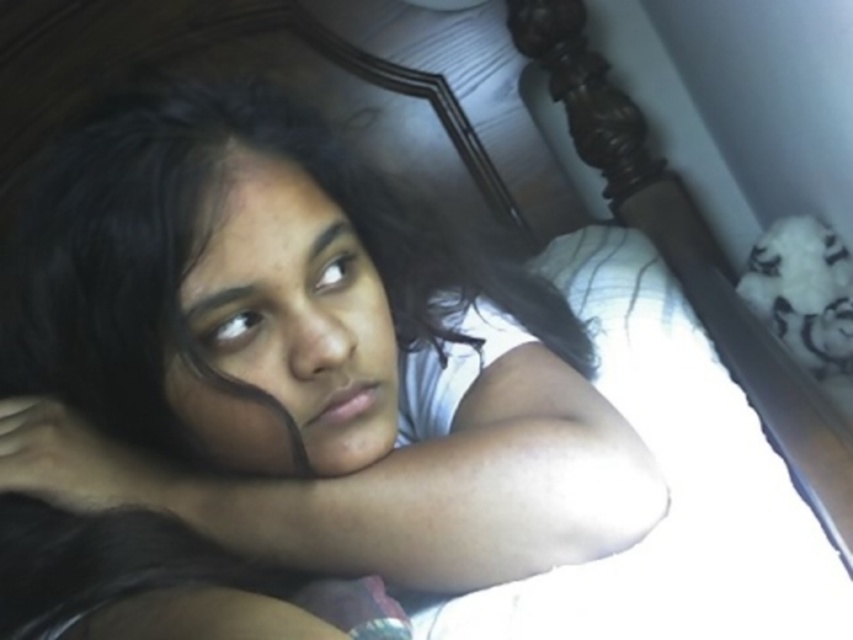
Question: Observing the image, what is the correct spatial positioning of smooth skin girl at center in reference to smooth skin face at center?

Choices:
 (A) left
 (B) right

Answer: (B)

Question: Observing the image, what is the correct spatial positioning of smooth skin girl at center in reference to smooth skin face at center?

Choices:
 (A) right
 (B) left

Answer: (A)

Question: Among these objects, which one is nearest to the camera?

Choices:
 (A) smooth skin face at center
 (B) smooth skin girl at center

Answer: (B)

Question: Does smooth skin girl at center appear on the right side of smooth skin face at center?

Choices:
 (A) no
 (B) yes

Answer: (B)

Question: Which point is farther to the camera?

Choices:
 (A) (524, 442)
 (B) (302, 236)

Answer: (A)